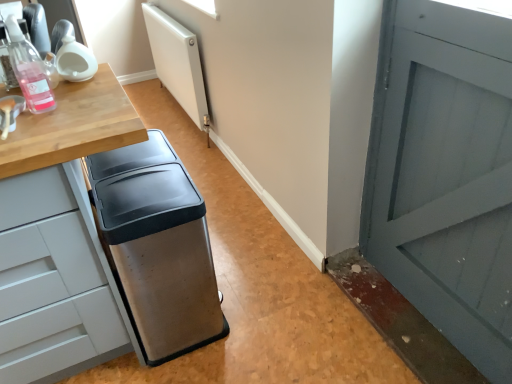
At what (x,y) coordinates should I click in order to perform the action: click on vacant area that is in front of white matte radiator at upper center. Please return your answer as a coordinate pair (x, y). This screenshot has width=512, height=384. Looking at the image, I should click on (189, 146).